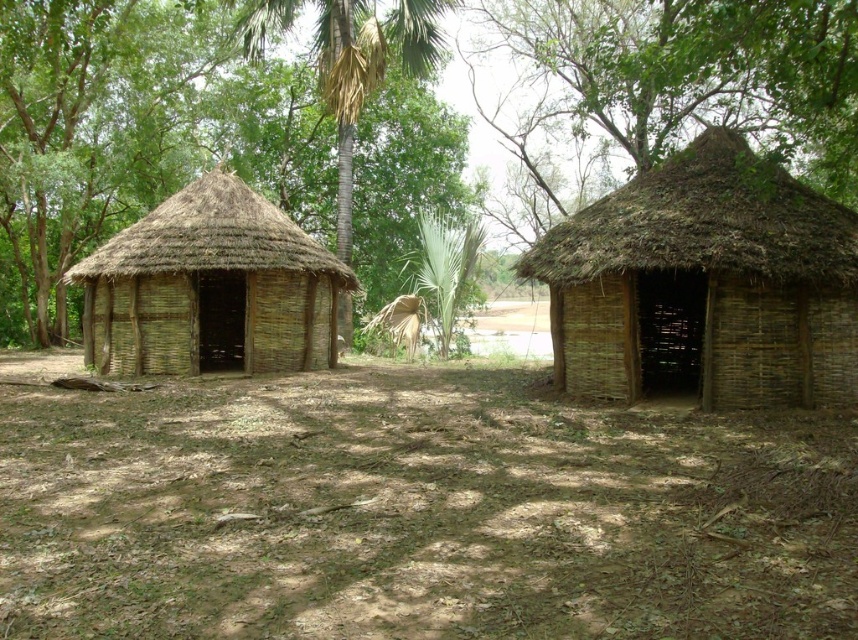
Question: Estimate the real-world distances between objects in this image. Which object is farther from the brown woven hut at left?

Choices:
 (A) green leafy palm tree at center
 (B) brown dirt field at center
 (C) brown thatch hut at center

Answer: (C)

Question: Is the position of brown thatch hut at center more distant than that of green leafy palm tree at center?

Choices:
 (A) no
 (B) yes

Answer: (A)

Question: Can you confirm if brown thatch hut at right is wider than brown woven hut at left?

Choices:
 (A) yes
 (B) no

Answer: (A)

Question: Can you confirm if brown thatch hut at center is positioned below brown thatch hut at right?

Choices:
 (A) yes
 (B) no

Answer: (B)

Question: Estimate the real-world distances between objects in this image. Which object is farther from the brown dirt field at center?

Choices:
 (A) brown thatch hut at center
 (B) brown thatch hut at right

Answer: (A)

Question: Which of the following is the farthest from the observer?

Choices:
 (A) brown thatch hut at center
 (B) green leafy palm tree at center
 (C) brown dirt field at center

Answer: (B)